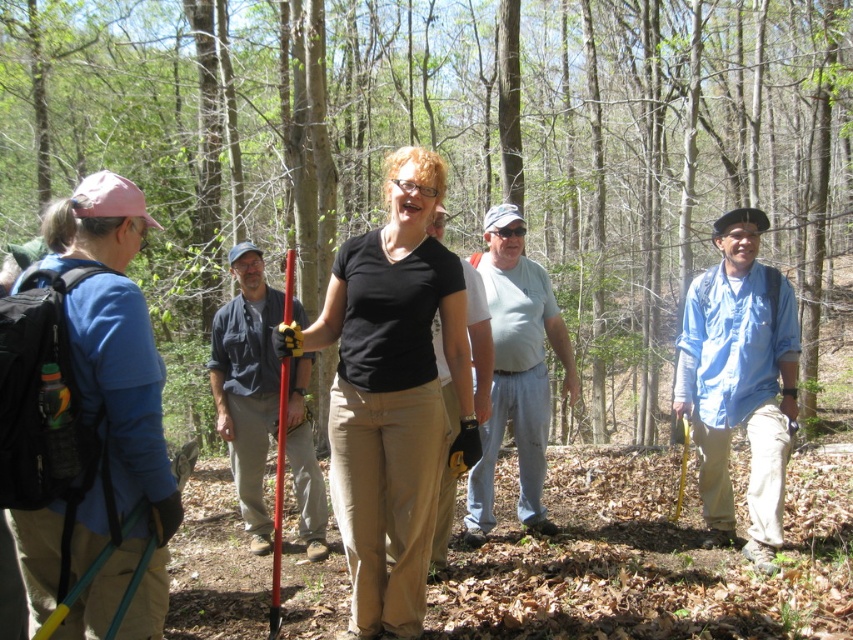
Who is shorter, light blue t-shirt at center or black cotton shirt at center?

black cotton shirt at center

I want to click on light blue t-shirt at center, so click(x=515, y=371).

What do you see at coordinates (515, 371) in the screenshot? Image resolution: width=853 pixels, height=640 pixels. I see `light blue t-shirt at center` at bounding box center [515, 371].

Identify the location of light blue t-shirt at center. (515, 371).

Between point (154, 209) and point (299, 326), which one is positioned in front?

Point (299, 326) is more forward.

Can you confirm if green leafy tree at center is positioned below black matte shirt at center?

No, green leafy tree at center is not below black matte shirt at center.

You are a GUI agent. You are given a task and a screenshot of the screen. Output one action in this format:
    pyautogui.click(x=<x>, y=<y>)
    Task: Click on the green leafy tree at center
    This screenshot has height=640, width=853.
    Given the screenshot: What is the action you would take?
    pyautogui.click(x=451, y=141)

Between green leafy tree at center and blue cotton shirt at right, which one appears on the right side from the viewer's perspective?

blue cotton shirt at right is more to the right.

Which is in front, point (351, 6) or point (787, 444)?

Point (787, 444) is in front.

Identify the location of green leafy tree at center. (451, 141).